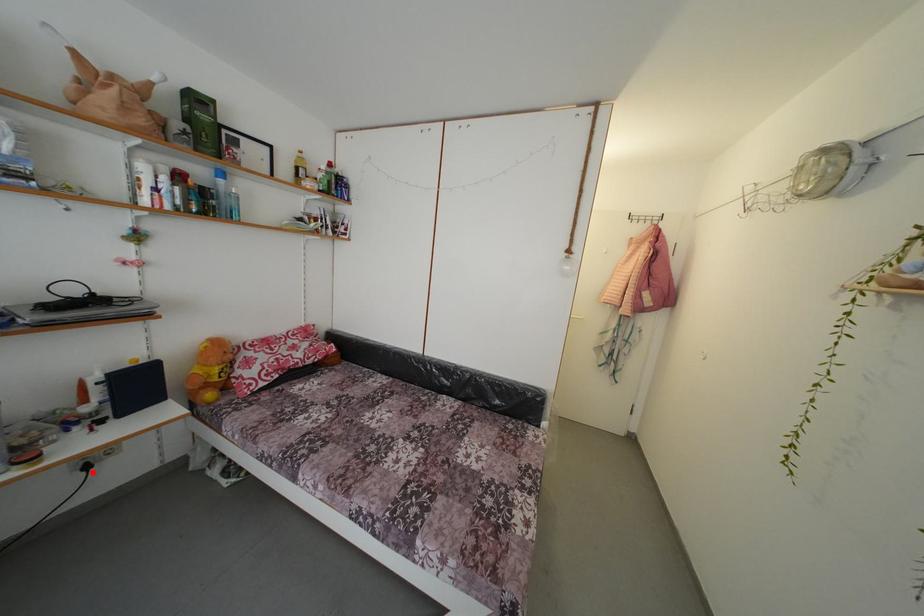
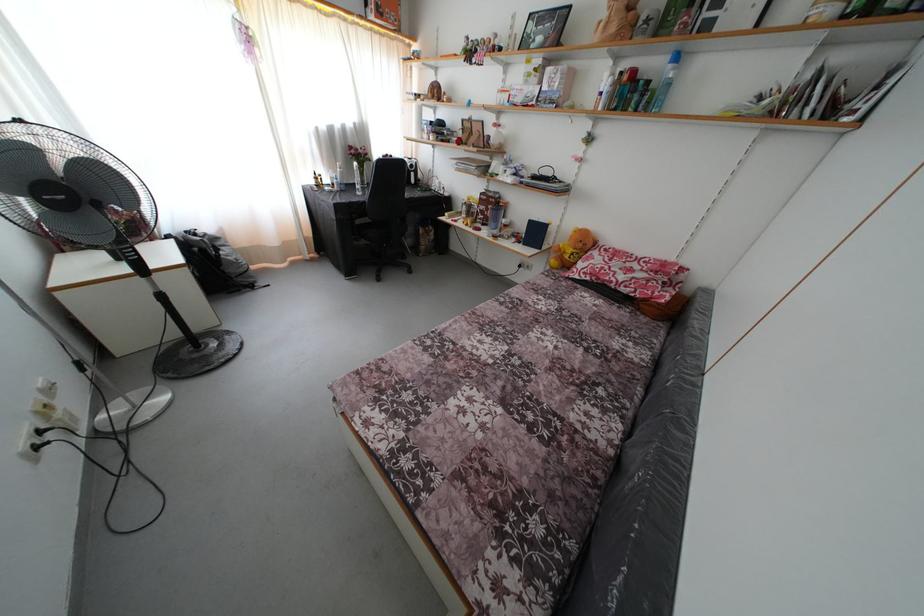
Where in the second image is the point corresponding to the highlighted location from the first image?

(525, 272)